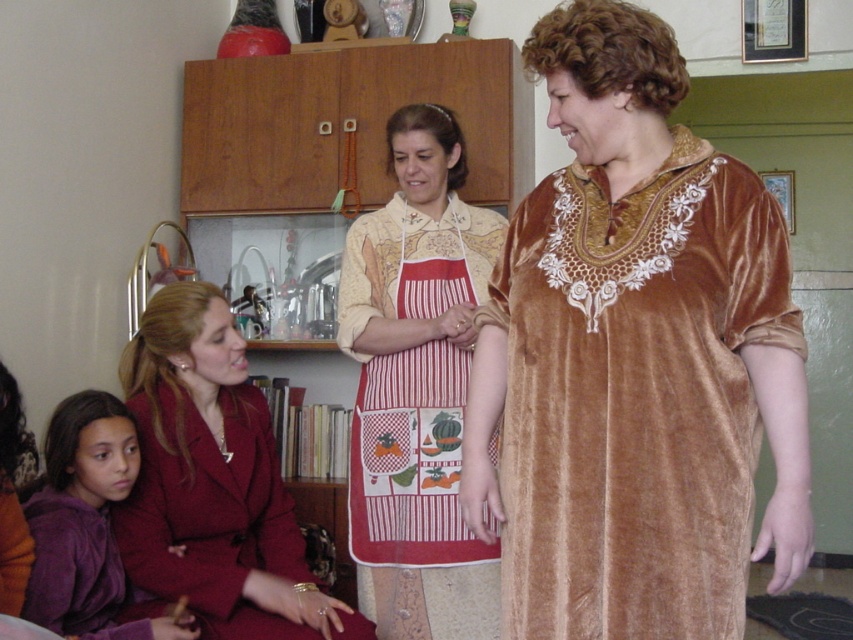
Is striped apron at center wider than velvet maroon blazer at lower left?

No, striped apron at center is not wider than velvet maroon blazer at lower left.

Describe the element at coordinates (416, 387) in the screenshot. The width and height of the screenshot is (853, 640). I see `striped apron at center` at that location.

I want to click on striped apron at center, so click(416, 387).

Does velvet gold dress at center appear over purple velvet sweater at lower left?

Yes, velvet gold dress at center is above purple velvet sweater at lower left.

Is velvet gold dress at center behind purple velvet sweater at lower left?

That is False.

Does point (605, 592) come closer to viewer compared to point (70, 420)?

Yes, it is.

Where is `velvet gold dress at center`? Image resolution: width=853 pixels, height=640 pixels. velvet gold dress at center is located at coordinates (634, 358).

Is velvet maroon blazer at lower left above purple velvet sweater at lower left?

Yes, velvet maroon blazer at lower left is above purple velvet sweater at lower left.

Does velvet maroon blazer at lower left appear on the right side of purple velvet sweater at lower left?

Correct, you'll find velvet maroon blazer at lower left to the right of purple velvet sweater at lower left.

At what (x,y) coordinates should I click in order to perform the action: click on velvet maroon blazer at lower left. Please return your answer as a coordinate pair (x, y). Looking at the image, I should click on (213, 483).

You are a GUI agent. You are given a task and a screenshot of the screen. Output one action in this format:
    pyautogui.click(x=<x>, y=<y>)
    Task: Click on the velvet maroon blazer at lower left
    This screenshot has height=640, width=853.
    Given the screenshot: What is the action you would take?
    pyautogui.click(x=213, y=483)